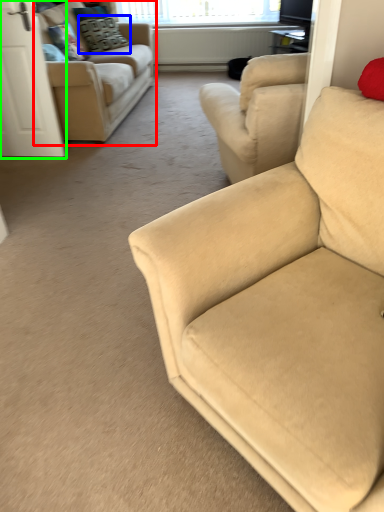
Question: Which object is the closest to the studio couch (highlighted by a red box)? Choose among these: pillow (highlighted by a blue box) or screen door (highlighted by a green box).

Choices:
 (A) pillow
 (B) screen door

Answer: (B)